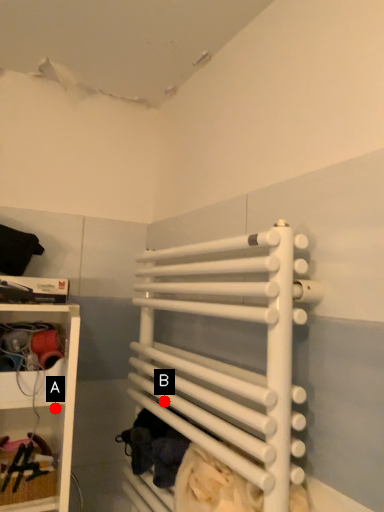
Question: Two points are circled on the image, labeled by A and B beside each circle. Which point appears closest to the camera in this image?

Choices:
 (A) A is closer
 (B) B is closer

Answer: (B)